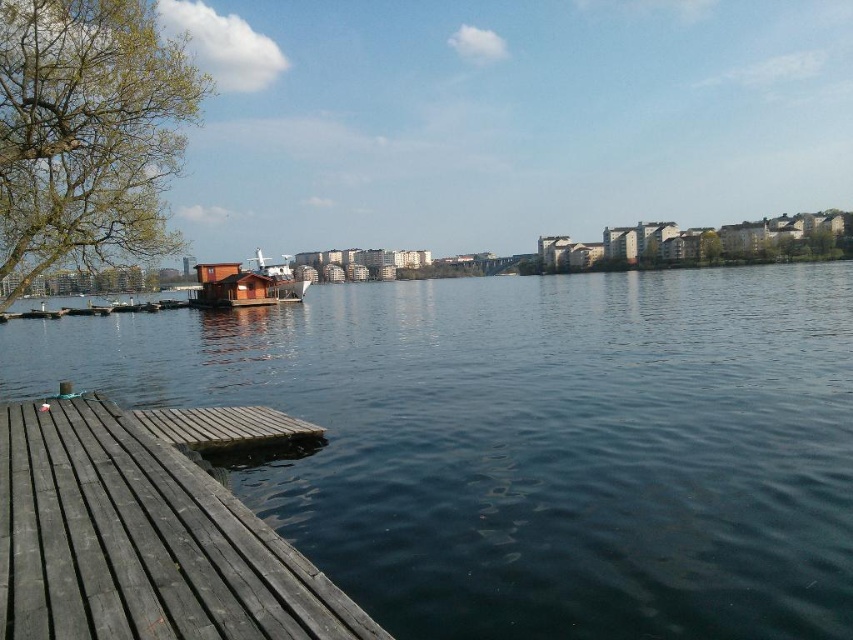
Can you confirm if brown wooden dock at lower left is positioned to the right of wooden cabin at center?

Correct, you'll find brown wooden dock at lower left to the right of wooden cabin at center.

Can you confirm if brown wooden dock at lower left is taller than wooden cabin at center?

No.

This screenshot has width=853, height=640. What do you see at coordinates (225, 426) in the screenshot?
I see `brown wooden dock at lower left` at bounding box center [225, 426].

Where is `brown wooden dock at lower left`? This screenshot has width=853, height=640. brown wooden dock at lower left is located at coordinates (225, 426).

The width and height of the screenshot is (853, 640). What do you see at coordinates (141, 540) in the screenshot? I see `dark gray wood dock at lower left` at bounding box center [141, 540].

Does dark gray wood dock at lower left have a larger size compared to brown wooden dock at lower left?

Indeed, dark gray wood dock at lower left has a larger size compared to brown wooden dock at lower left.

Between point (167, 593) and point (241, 440), which one is positioned behind?

The point (241, 440) is behind.

This screenshot has width=853, height=640. Identify the location of dark gray wood dock at lower left. (141, 540).

Between dark blue water at center and brown wooden dock at lower left, which one has less height?

Standing shorter between the two is brown wooden dock at lower left.

Does point (149, 381) lie behind point (267, 419)?

Yes.

Locate an element on the screen. The image size is (853, 640). dark blue water at center is located at coordinates (531, 442).